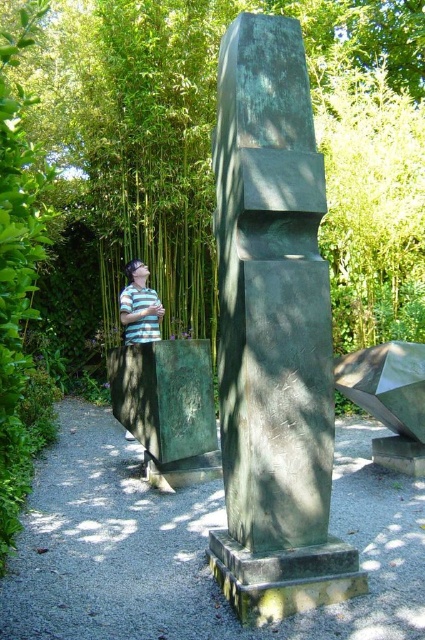
Is green stone sculpture at center further to the viewer compared to striped shirt at lower left?

No, green stone sculpture at center is in front of striped shirt at lower left.

Where is `green stone sculpture at center`? This screenshot has height=640, width=425. green stone sculpture at center is located at coordinates (272, 333).

Who is more distant from viewer, (299, 593) or (150, 333)?

The point (150, 333) is more distant.

The height and width of the screenshot is (640, 425). I want to click on green stone sculpture at center, so click(x=272, y=333).

Is green stone sculpture at center wider than gray gravel path at center?

No, green stone sculpture at center is not wider than gray gravel path at center.

Can you confirm if green stone sculpture at center is positioned above gray gravel path at center?

Yes.

Is point (317, 579) positioned after point (85, 593)?

That is False.

The height and width of the screenshot is (640, 425). I want to click on green stone sculpture at center, so click(272, 333).

Is gray gravel path at center further to the viewer compared to striped shirt at lower left?

No.

Between point (183, 628) and point (153, 301), which one is positioned in front?

Point (183, 628)

Is point (170, 588) farther from viewer compared to point (138, 326)?

No, it is in front of (138, 326).

You are a GUI agent. You are given a task and a screenshot of the screen. Output one action in this format:
    pyautogui.click(x=<x>, y=<y>)
    Task: Click on the gray gravel path at center
    This screenshot has height=640, width=425.
    Given the screenshot: What is the action you would take?
    pyautogui.click(x=190, y=547)